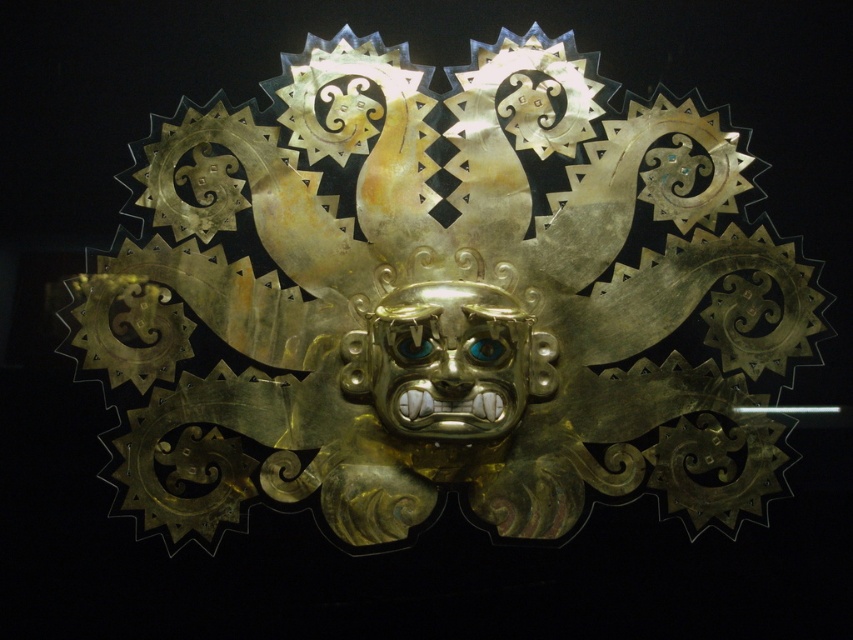
Question: Among these objects, which one is farthest from the camera?

Choices:
 (A) gold/metallic mask at center
 (B) gold textured mask at center

Answer: (B)

Question: Is gold/metallic mask at center smaller than gold textured mask at center?

Choices:
 (A) no
 (B) yes

Answer: (A)

Question: Can you confirm if gold/metallic mask at center is positioned above gold textured mask at center?

Choices:
 (A) no
 (B) yes

Answer: (A)

Question: Which point appears closest to the camera in this image?

Choices:
 (A) (341, 104)
 (B) (473, 328)

Answer: (B)

Question: Among these objects, which one is nearest to the camera?

Choices:
 (A) gold/metallic mask at center
 (B) gold textured mask at center

Answer: (A)

Question: From the image, what is the correct spatial relationship of gold/metallic mask at center in relation to gold textured mask at center?

Choices:
 (A) above
 (B) below

Answer: (B)